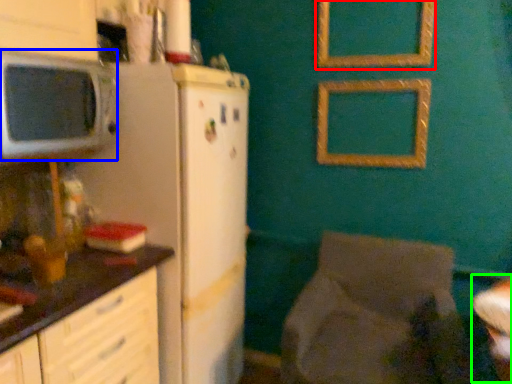
Question: Which object is the farthest from picture frame (highlighted by a red box)? Choose among these: microwave oven (highlighted by a blue box) or table (highlighted by a green box).

Choices:
 (A) microwave oven
 (B) table

Answer: (A)